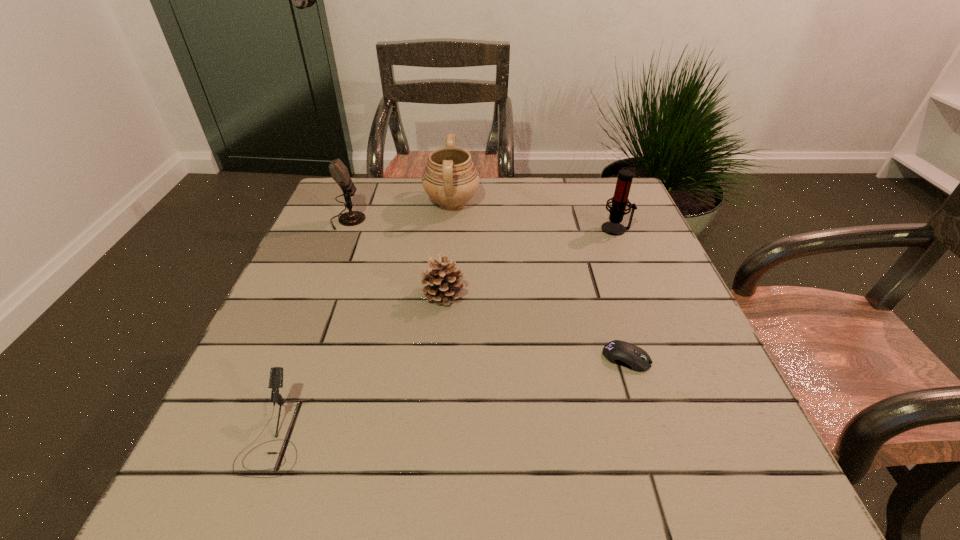
You are a GUI agent. You are given a task and a screenshot of the screen. Output one action in this format:
    pyautogui.click(x=<x>, y=<y>)
    Task: Click on the free spot between the third nearest object and the computer equipment
    The image size is (960, 540).
    Given the screenshot: What is the action you would take?
    pyautogui.click(x=535, y=326)

Image resolution: width=960 pixels, height=540 pixels. What are the coordinates of `free space between the computer equipment and the urn` in the screenshot? It's located at (540, 281).

Locate an element on the screen. The image size is (960, 540). object that is the second nearest to the rightmost microphone is located at coordinates (622, 353).

Select which object appears as the third closest to the urn. Please provide its 2D coordinates. Your answer should be formatted as a tuple, i.e. [(x, y)], where the tuple contains the x and y coordinates of a point satisfying the conditions above.

[(620, 200)]

Identify the location of microphone that stands as the second closest to the nearest object. The image size is (960, 540). (620, 200).

Where is `the second closest microphone to the urn`? the second closest microphone to the urn is located at coordinates (620, 200).

Identify the location of free point that satisfies the following two spatial constraints: 1. on the front-facing side of the urn; 2. on the left side of the computer equipment. The image size is (960, 540). (438, 358).

Where is `free location that satisfies the following two spatial constraints: 1. on the back side of the shortest object; 2. on the left side of the rightmost microphone`? This screenshot has height=540, width=960. free location that satisfies the following two spatial constraints: 1. on the back side of the shortest object; 2. on the left side of the rightmost microphone is located at coordinates (586, 229).

Identify the location of free space in the image that satisfies the following two spatial constraints: 1. on the front-facing side of the urn; 2. on the back side of the pinecone. (444, 294).

Where is `vacant area in the image that satisfies the following two spatial constraints: 1. on the back side of the pinecone; 2. on the front-facing side of the urn`? Image resolution: width=960 pixels, height=540 pixels. vacant area in the image that satisfies the following two spatial constraints: 1. on the back side of the pinecone; 2. on the front-facing side of the urn is located at coordinates (452, 203).